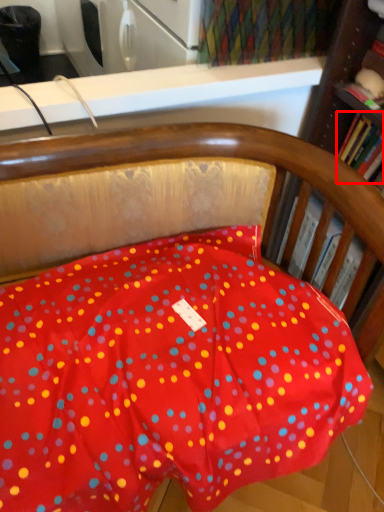
Question: From the image's perspective, where is book (annotated by the red box) located relative to book?

Choices:
 (A) below
 (B) above

Answer: (B)